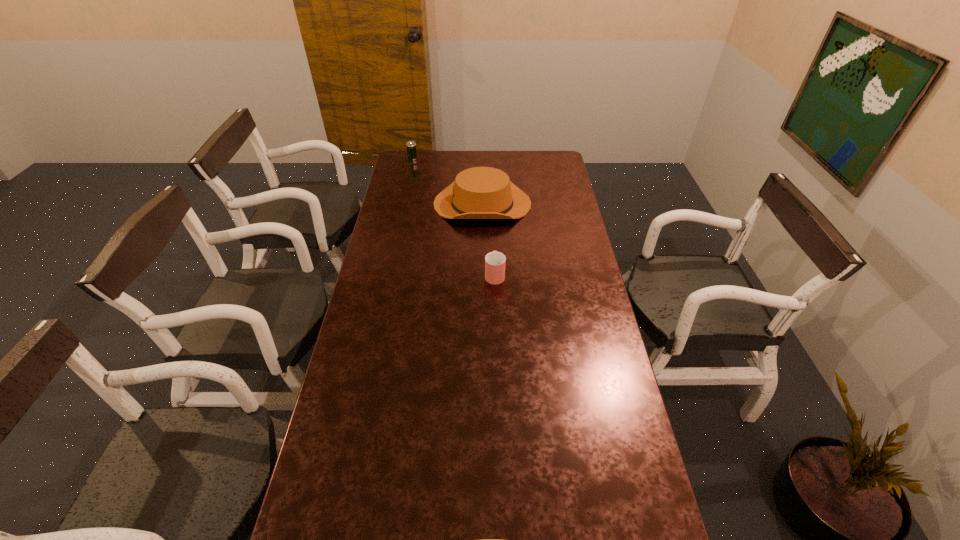
Find the location of a particular element. Image resolution: width=960 pixels, height=540 pixels. object that is the nearest to the farthest object is located at coordinates (480, 192).

This screenshot has height=540, width=960. I want to click on object that ranks as the closest to the leftmost object, so click(480, 192).

What are the coordinates of `vacant space that satisfies the following two spatial constraints: 1. on the front-facing side of the third nearest object; 2. on the side of the cup with the handle` in the screenshot? It's located at (483, 274).

At what (x,y) coordinates should I click in order to perform the action: click on blank space that satisfies the following two spatial constraints: 1. on the front-facing side of the third nearest object; 2. on the side of the cup with the handle. Please return your answer as a coordinate pair (x, y). Looking at the image, I should click on (483, 274).

What are the coordinates of `free location that satisfies the following two spatial constraints: 1. on the front-facing side of the cowboy hat; 2. on the side of the second nearest object with the handle` in the screenshot? It's located at (483, 274).

Find the location of a particular element. The width and height of the screenshot is (960, 540). vacant space that satisfies the following two spatial constraints: 1. on the side of the cup with the handle; 2. on the front-facing side of the second farthest object is located at coordinates (492, 204).

I want to click on vacant point that satisfies the following two spatial constraints: 1. on the front-facing side of the third nearest object; 2. on the side of the cup with the handle, so click(483, 274).

The image size is (960, 540). Identify the location of free space that satisfies the following two spatial constraints: 1. on the front-facing side of the second farthest object; 2. on the side of the cup with the handle. (483, 274).